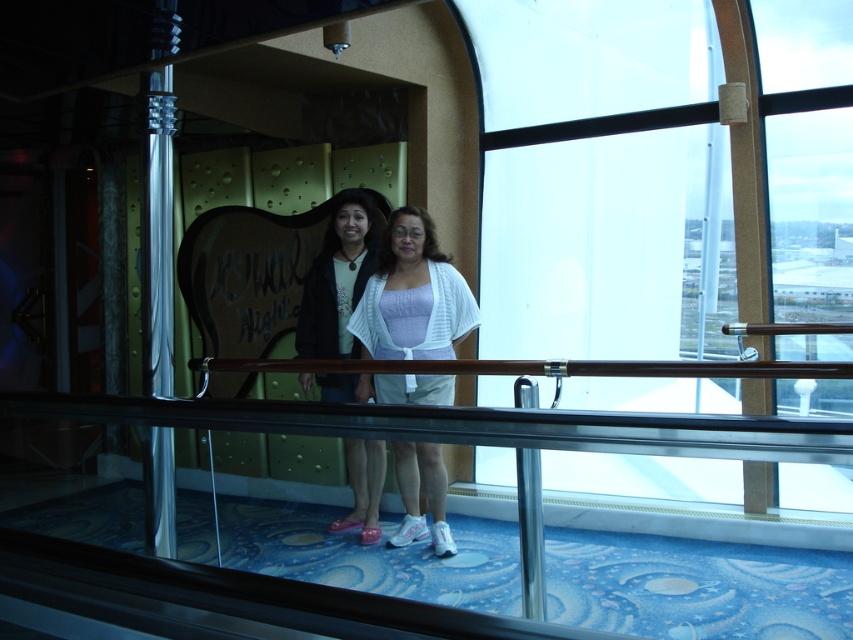
Looking at this image, does white knit cardigan at center come in front of matte black jacket at center?

Yes, white knit cardigan at center is closer to the viewer.

Image resolution: width=853 pixels, height=640 pixels. Describe the element at coordinates (413, 296) in the screenshot. I see `white knit cardigan at center` at that location.

Where is `white knit cardigan at center`? This screenshot has height=640, width=853. white knit cardigan at center is located at coordinates (413, 296).